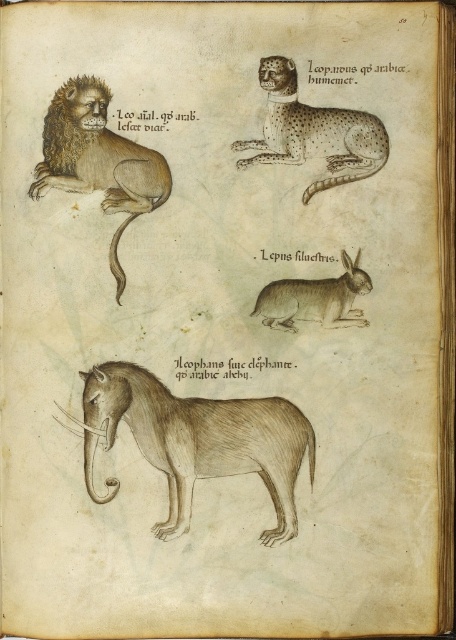
You are standing in front of an old manuscript. There is a point labeled at coordinates (187,492). If you want to touch this point with a ruler that is 1.5 meters long, can you reach it?

The point at (187,492) is 1.65 meters away from you. Since the ruler is only 1.5 meters long, you cannot reach it.

Looking at the old manuscript, you see the brown fur lion at left and the brown textured elephant at center. Which animal is positioned higher on the page?

The brown fur lion at left is positioned higher on the page than the brown textured elephant at center.

You are an archivist examining the old manuscript. You notice two points marked on the page at coordinates point (134, 364) and point (57, 145). Which point is closer to the viewer?

Point (57, 145) is closer to the viewer because the description states that point (134, 364) is behind it.